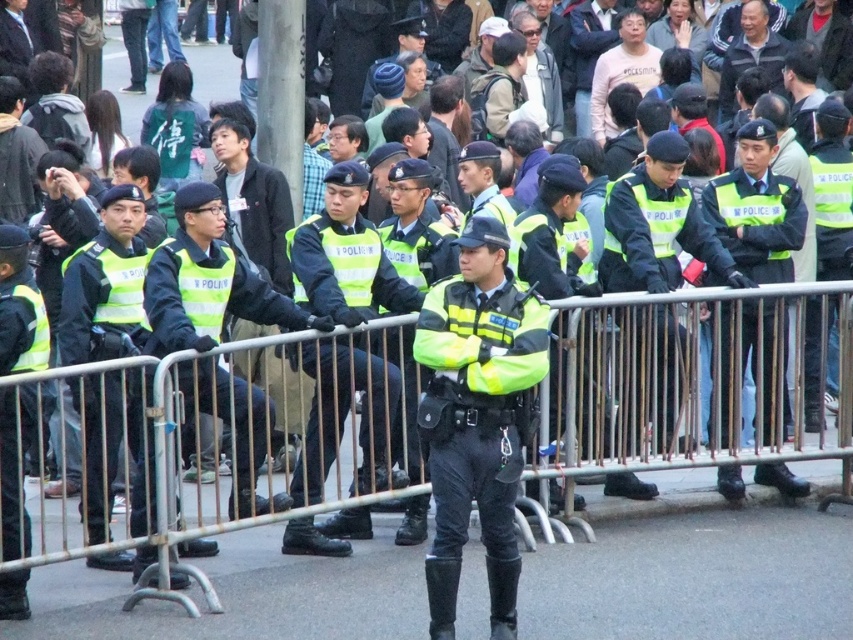
Can you confirm if neon yellow reflective uniform at center is positioned below high-visibility reflective jacket at center?

Indeed, neon yellow reflective uniform at center is positioned under high-visibility reflective jacket at center.

Does neon yellow reflective uniform at center have a smaller size compared to high-visibility reflective jacket at center?

Incorrect, neon yellow reflective uniform at center is not smaller in size than high-visibility reflective jacket at center.

Which is behind, point (436, 531) or point (727, 333)?

The point (727, 333) is behind.

You are a GUI agent. You are given a task and a screenshot of the screen. Output one action in this format:
    pyautogui.click(x=<x>, y=<y>)
    Task: Click on the neon yellow reflective uniform at center
    The height and width of the screenshot is (640, 853).
    Given the screenshot: What is the action you would take?
    pyautogui.click(x=476, y=417)

Can you confirm if reflective green vest at center is positioned to the right of high-visibility reflective jacket at center?

No, reflective green vest at center is not to the right of high-visibility reflective jacket at center.

In the scene shown: Who is lower down, reflective green vest at center or high-visibility reflective jacket at center?

reflective green vest at center is below.

At what (x,y) coordinates should I click in order to perform the action: click on reflective green vest at center. Please return your answer as a coordinate pair (x, y). Looking at the image, I should click on (345, 257).

The width and height of the screenshot is (853, 640). Find the location of `reflective green vest at center`. reflective green vest at center is located at coordinates (345, 257).

Is metallic silver rail at center taller than reflective green vest at center?

Indeed, metallic silver rail at center has a greater height compared to reflective green vest at center.

Between metallic silver rail at center and reflective green vest at center, which one appears on the right side from the viewer's perspective?

From the viewer's perspective, metallic silver rail at center appears more on the right side.

You are a GUI agent. You are given a task and a screenshot of the screen. Output one action in this format:
    pyautogui.click(x=<x>, y=<y>)
    Task: Click on the metallic silver rail at center
    This screenshot has height=640, width=853.
    Given the screenshot: What is the action you would take?
    pyautogui.click(x=659, y=394)